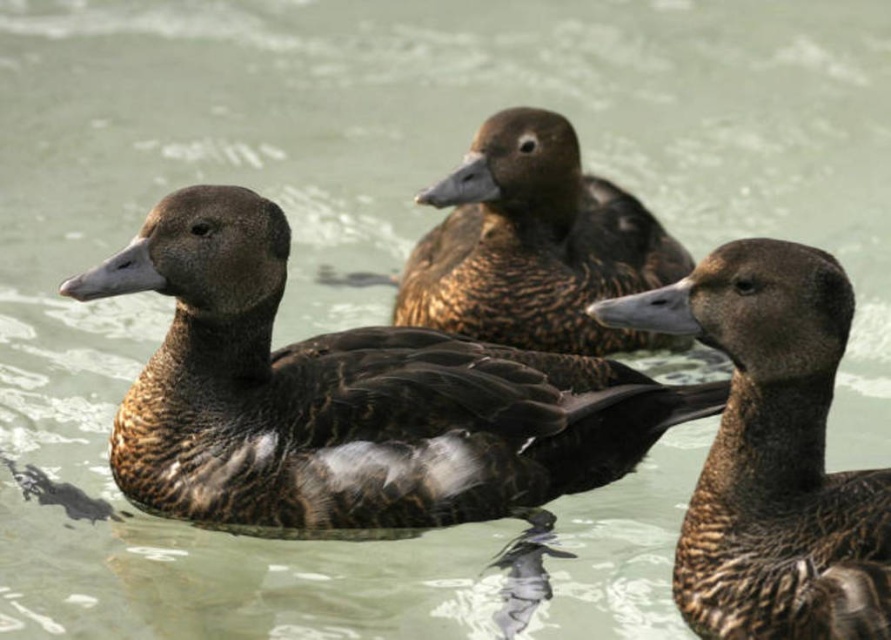
Who is higher up, brown matte duck at center or brown speckled duck at center?

Positioned higher is brown matte duck at center.

Does brown matte duck at center have a greater height compared to brown speckled duck at center?

Incorrect, brown matte duck at center's height is not larger of brown speckled duck at center's.

Where is `brown matte duck at center`? Image resolution: width=891 pixels, height=640 pixels. brown matte duck at center is located at coordinates (348, 397).

Does brown speckled duck at center appear over brown speckled feathers at center?

Actually, brown speckled duck at center is below brown speckled feathers at center.

Measure the distance from brown speckled duck at center to brown speckled feathers at center.

A distance of 1.26 meters exists between brown speckled duck at center and brown speckled feathers at center.

Is point (634, 321) positioned before point (470, 316)?

That is True.

Locate an element on the screen. brown speckled duck at center is located at coordinates (772, 452).

Which is more to the left, brown matte duck at center or brown speckled feathers at center?

Positioned to the left is brown matte duck at center.

Is the position of brown matte duck at center more distant than that of brown speckled feathers at center?

No, brown matte duck at center is in front of brown speckled feathers at center.

Does point (308, 424) come behind point (573, 344)?

No.

Find the location of a particular element. brown matte duck at center is located at coordinates (348, 397).